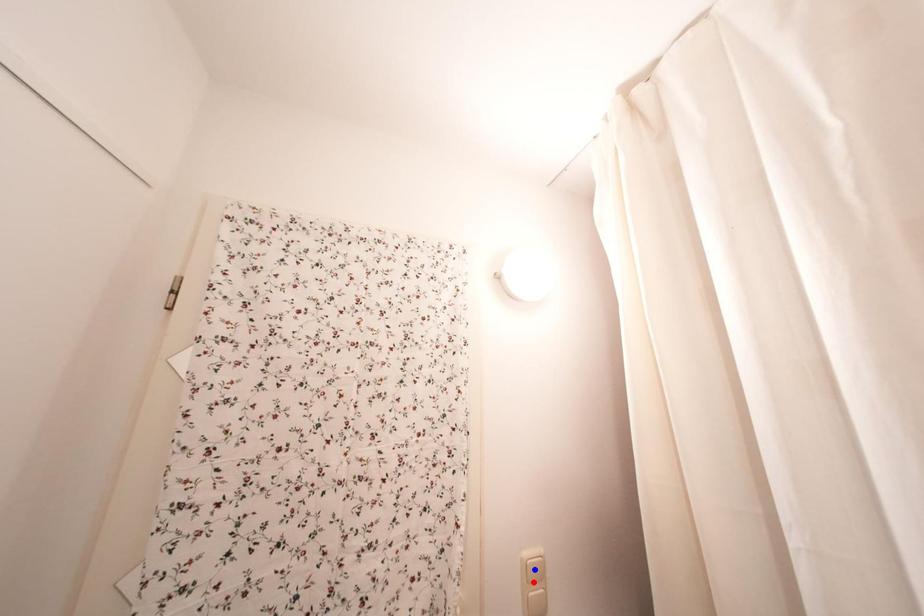
Question: Which of the two points in the image is closer to the camera?

Choices:
 (A) Blue point is closer.
 (B) Red point is closer.

Answer: (A)